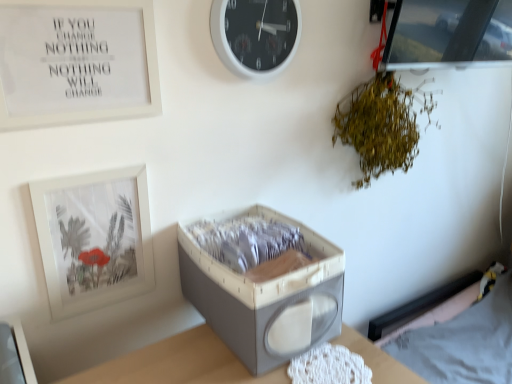
Question: Should I look upward or downward to see transparent glass picture frame at upper right, the first picture frame from the right?

Choices:
 (A) up
 (B) down

Answer: (A)

Question: Is gray fabric storage box at center behind white matte picture frame at upper left, which is the second picture frame from bottom to top?

Choices:
 (A) yes
 (B) no

Answer: (A)

Question: From a real-world perspective, is gray fabric storage box at center over white matte picture frame at upper left, which is the second picture frame from bottom to top?

Choices:
 (A) no
 (B) yes

Answer: (A)

Question: Is gray fabric storage box at center at the right side of white matte picture frame at upper left, the 2th picture frame when ordered from right to left?

Choices:
 (A) no
 (B) yes

Answer: (B)

Question: Is gray fabric storage box at center positioned before white matte picture frame at upper left, which is counted as the second picture frame, starting from the top?

Choices:
 (A) yes
 (B) no

Answer: (B)

Question: Does gray fabric storage box at center have a lesser width compared to white matte picture frame at upper left, which is the second picture frame from left to right?

Choices:
 (A) no
 (B) yes

Answer: (A)

Question: Considering the relative sizes of gray fabric storage box at center and white matte picture frame at upper left, which is the second picture frame from bottom to top, in the image provided, is gray fabric storage box at center wider than white matte picture frame at upper left, which is the second picture frame from bottom to top,?

Choices:
 (A) no
 (B) yes

Answer: (B)

Question: Is white matte picture frame at upper left, positioned as the 3th picture frame in right-to-left order, thinner than white matte picture frame at upper left, the 2th picture frame when ordered from right to left?

Choices:
 (A) yes
 (B) no

Answer: (A)

Question: Is white matte picture frame at upper left, positioned as the 3th picture frame in right-to-left order, positioned beyond the bounds of white matte picture frame at upper left, the 2th picture frame when ordered from right to left?

Choices:
 (A) yes
 (B) no

Answer: (A)

Question: From the image's perspective, is white matte picture frame at upper left, positioned as the 3th picture frame in right-to-left order, located beneath white matte picture frame at upper left, which is the second picture frame from left to right?

Choices:
 (A) yes
 (B) no

Answer: (A)

Question: Can you confirm if white matte picture frame at upper left, which is the 3th picture frame from top to bottom, is positioned to the left of white matte picture frame at upper left, the 2th picture frame when ordered from right to left?

Choices:
 (A) no
 (B) yes

Answer: (B)

Question: Considering the relative sizes of white matte picture frame at upper left, which appears as the 1th picture frame when viewed from the left, and white matte picture frame at upper left, which is the second picture frame from bottom to top, in the image provided, is white matte picture frame at upper left, which appears as the 1th picture frame when viewed from the left, wider than white matte picture frame at upper left, which is the second picture frame from bottom to top,?

Choices:
 (A) yes
 (B) no

Answer: (B)

Question: From a real-world perspective, is white matte picture frame at upper left, which is the 3th picture frame from top to bottom, located beneath white matte picture frame at upper left, which is the second picture frame from bottom to top?

Choices:
 (A) no
 (B) yes

Answer: (B)

Question: Considering the relative sizes of transparent glass picture frame at upper right, the first picture frame from the right, and white fabric hospital bed at lower right in the image provided, is transparent glass picture frame at upper right, the first picture frame from the right, taller than white fabric hospital bed at lower right?

Choices:
 (A) yes
 (B) no

Answer: (B)